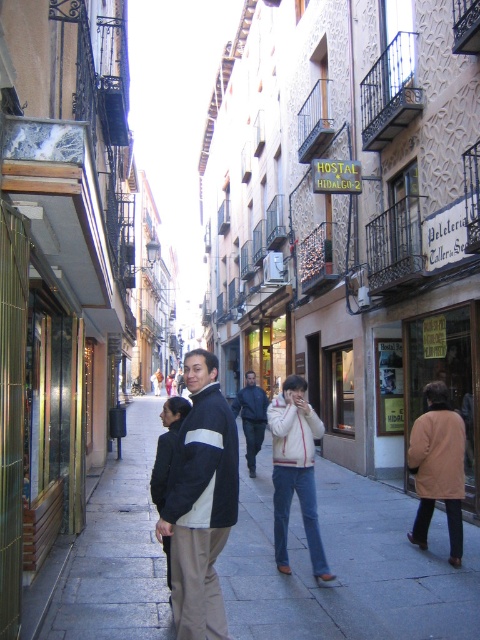
You are a tourist standing on the smooth concrete sidewalk at center and want to pick up the black jacket at center. Is the jacket closer to you or further away?

The smooth concrete sidewalk at center is further to the viewer than black jacket at center, so the jacket is closer to you.

You are a traveler who just arrived at the European city and you see two jackets hanging on a rack in the Hostal Hidalgo 2 store. The jackets are a black jacket at center and a dark blue jacket at center. Which jacket is bigger?

The black jacket at center has a larger size compared to the dark blue jacket at center, so the black jacket at center is bigger.

You are standing on the smooth concrete sidewalk at center. You want to walk to the point at coordinates (346, 566). Is the point you want to walk to located on the smooth concrete sidewalk at center?

The smooth concrete sidewalk at center is located at point (346, 566), so yes, the point you want to walk to is located on the smooth concrete sidewalk at center.